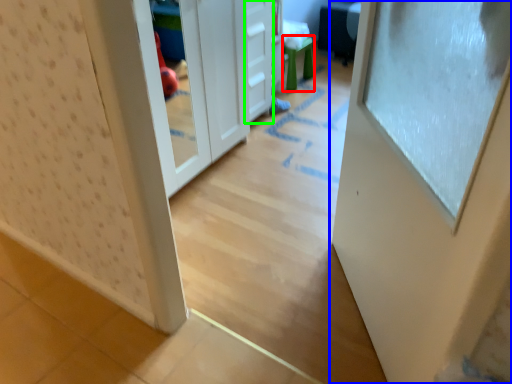
Question: Which is farther away from stool (highlighted by a red box)? door (highlighted by a blue box) or drawer (highlighted by a green box)?

Choices:
 (A) door
 (B) drawer

Answer: (A)